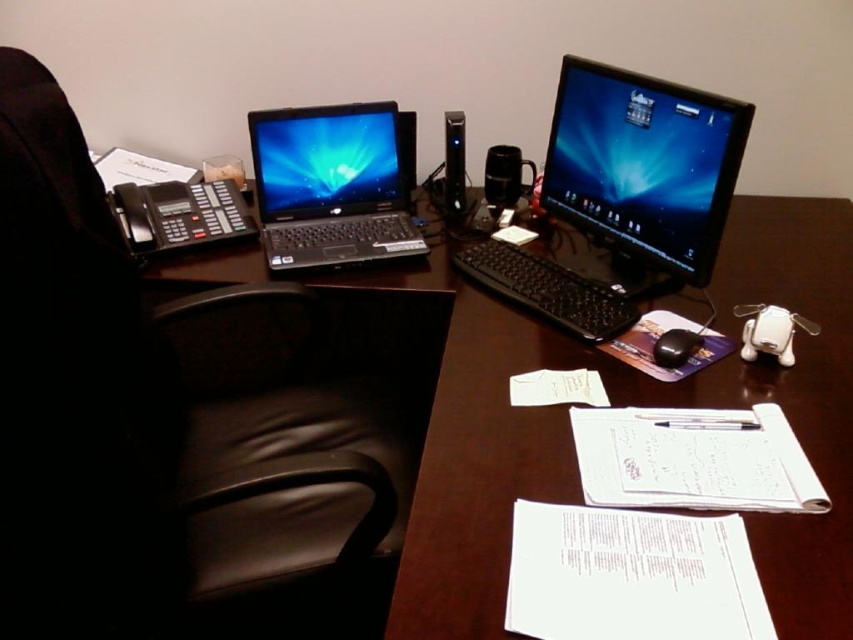
Question: Among these objects, which one is farthest from the camera?

Choices:
 (A) shiny black laptop at left
 (B) black plastic keyboard at center

Answer: (A)

Question: Is satin black monitor at center thinner than black plastic keyboard at center?

Choices:
 (A) no
 (B) yes

Answer: (B)

Question: Which point is farther to the camera?

Choices:
 (A) (425, 445)
 (B) (277, 113)
 (C) (648, 237)
 (D) (206, 241)

Answer: (B)

Question: Does black leather swivel chair at left appear under satin black monitor at center?

Choices:
 (A) yes
 (B) no

Answer: (A)

Question: Which of the following is the closest to the observer?

Choices:
 (A) black leather swivel chair at left
 (B) satin black monitor at center

Answer: (A)

Question: Considering the relative positions of black leather swivel chair at left and black matte mouse at center in the image provided, where is black leather swivel chair at left located with respect to black matte mouse at center?

Choices:
 (A) above
 (B) below

Answer: (B)